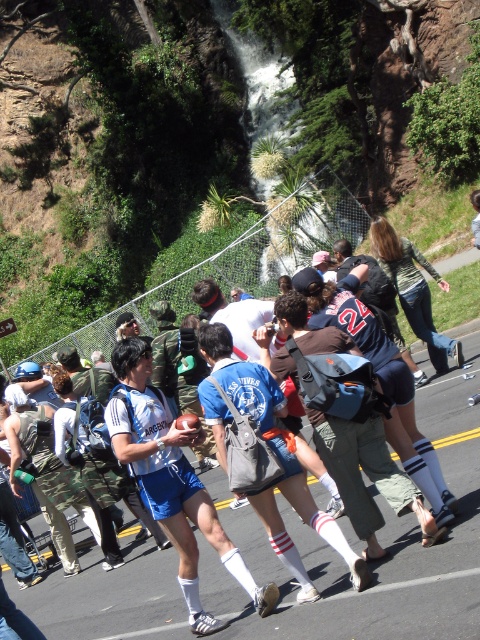
Which is in front, point (222, 596) or point (346, 243)?

Point (222, 596)

Which is more to the left, white fabric shorts at center or dark blue jersey at center?

white fabric shorts at center is more to the left.

Between point (432, 616) and point (344, 243), which one is positioned in front?

Point (432, 616)

At what (x,y) coordinates should I click in order to perform the action: click on white fabric shorts at center. Please return your answer as a coordinate pair (x, y). This screenshot has width=480, height=640. Looking at the image, I should click on (379, 538).